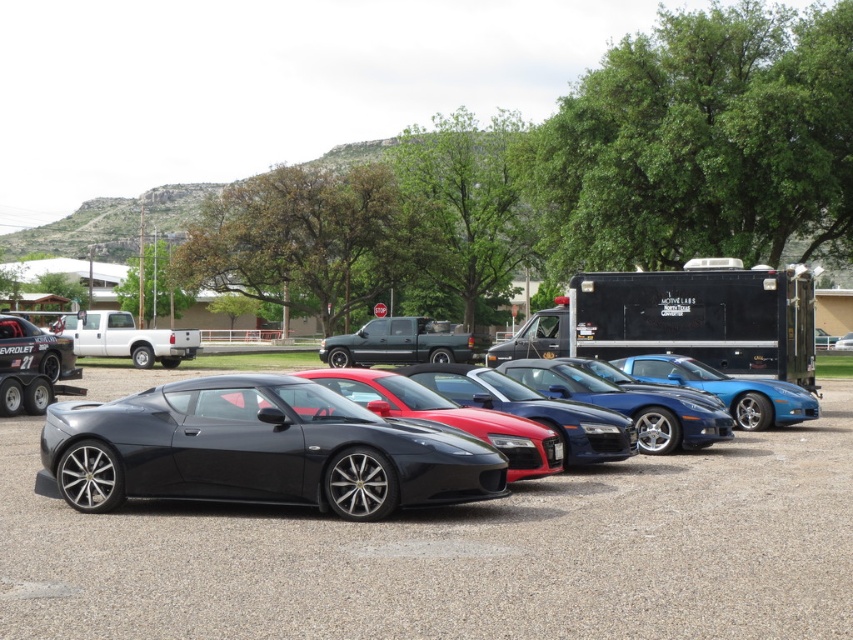
Question: Is black matte trailer at center above glossy blue car at center?

Choices:
 (A) no
 (B) yes

Answer: (B)

Question: Considering the relative positions of shiny black sports car at center and glossy black sports car at center in the image provided, where is shiny black sports car at center located with respect to glossy black sports car at center?

Choices:
 (A) above
 (B) below

Answer: (B)

Question: Which point is farther to the camera?

Choices:
 (A) black matte trailer at center
 (B) matte black truck at center

Answer: (B)

Question: Is glossy black car at center in front of matte black truck at center?

Choices:
 (A) yes
 (B) no

Answer: (A)

Question: Which point is closer to the camera taking this photo?

Choices:
 (A) click(x=527, y=458)
 (B) click(x=759, y=312)
 (C) click(x=315, y=448)
 (D) click(x=708, y=560)

Answer: (D)

Question: Estimate the real-world distances between objects in this image. Which object is closer to the glossy black car at center?

Choices:
 (A) glossy black sports car at center
 (B) black matte trailer at center

Answer: (A)